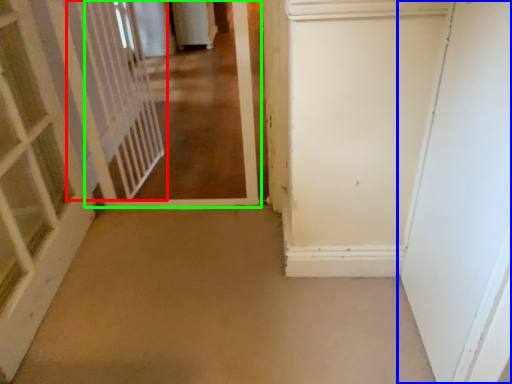
Question: Estimate the real-world distances between objects in this image. Which object is closer to elevator (highlighted by a red box), door (highlighted by a blue box) or corridor (highlighted by a green box)?

Choices:
 (A) door
 (B) corridor

Answer: (B)